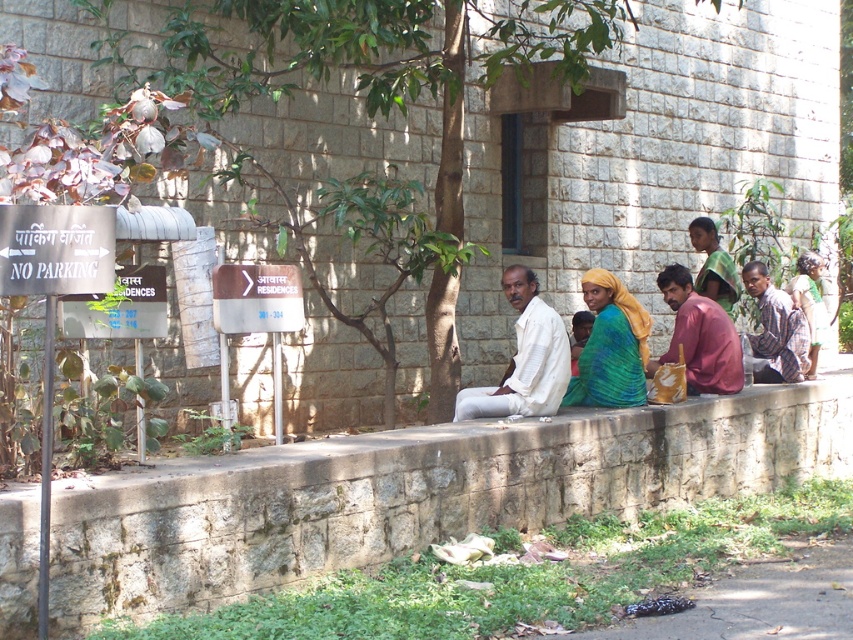
Question: Is green textured fabric at center above maroon fabric shirt at center?

Choices:
 (A) no
 (B) yes

Answer: (A)

Question: Is green leafy tree at center thinner than white cotton shirt at center?

Choices:
 (A) yes
 (B) no

Answer: (B)

Question: Which object is positioned closest to the plaid fabric shirt at right?

Choices:
 (A) stone ledge at center
 (B) white cotton shirt at center
 (C) green leafy tree at center

Answer: (B)

Question: Based on their relative distances, which object is farther from the green textured fabric at center?

Choices:
 (A) maroon fabric shirt at center
 (B) green leafy tree at center
 (C) stone ledge at center

Answer: (C)

Question: Considering the real-world distances, which object is closest to the green leafy tree at center?

Choices:
 (A) stone ledge at center
 (B) green fabric headscarf at upper right
 (C) green textured fabric at center
 (D) plaid fabric shirt at right

Answer: (C)

Question: Is stone ledge at center smaller than plaid fabric shirt at right?

Choices:
 (A) no
 (B) yes

Answer: (B)